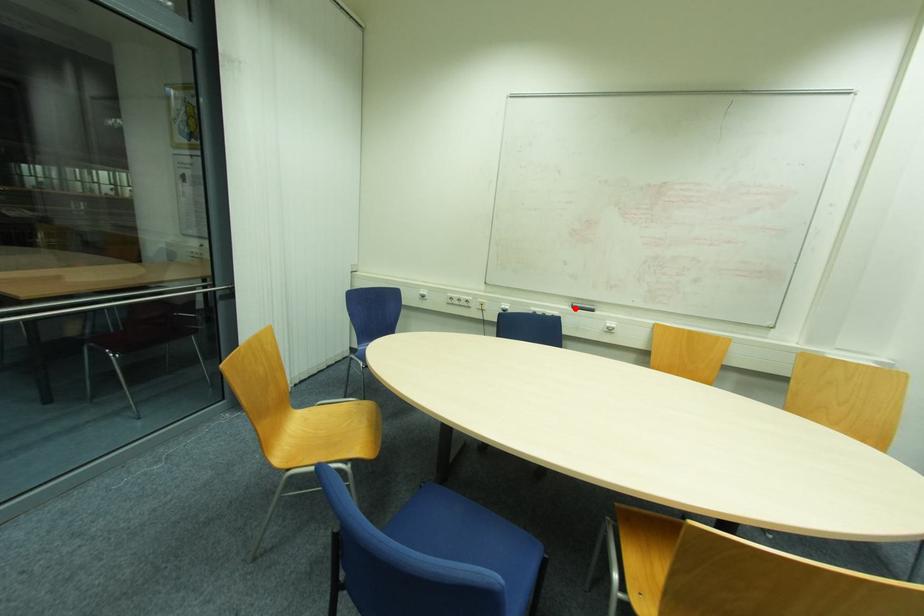
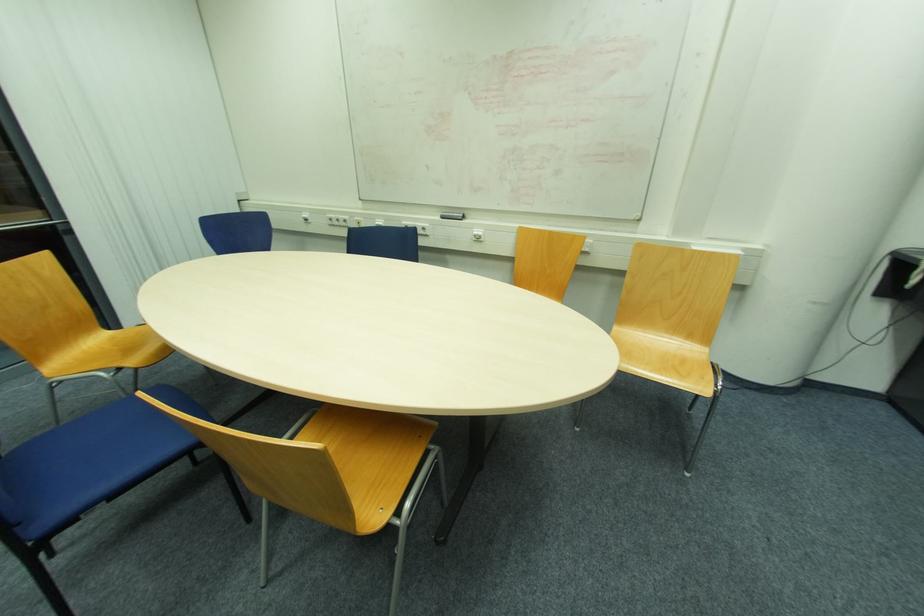
Question: I am providing you with two images of the same scene from different viewpoints. Image1 has a red point marked. In image2, the corresponding 3D location appears at what relative position? Reply with the corresponding letter.

Choices:
 (A) Closer
 (B) Farther

Answer: (B)